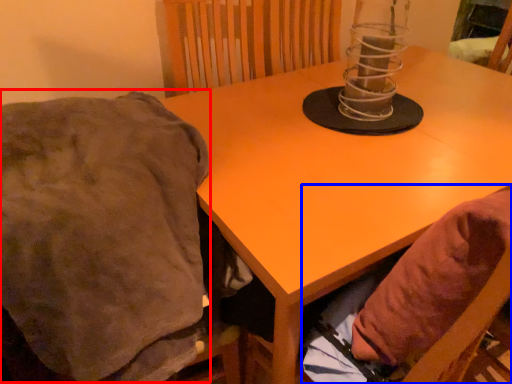
Question: Which of the following is the farthest to the observer, blanket (highlighted by a red box) or bean bag chair (highlighted by a blue box)?

Choices:
 (A) blanket
 (B) bean bag chair

Answer: (B)